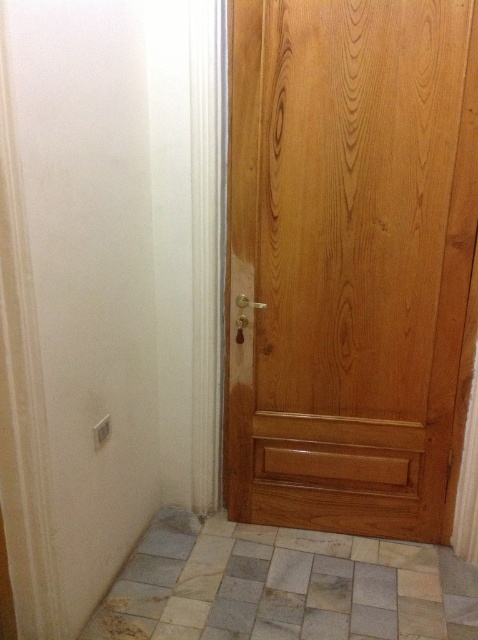
You are standing in the room and need to clean the wooden door at right and the natural stone tile at lower center. Which object requires a larger cleaning area?

The wooden door at right requires a larger cleaning area because it is larger in size than the natural stone tile at lower center.

You are a delivery person trying to move a 70 cm wide package through the doorway between the wooden door at right and the natural stone tile at lower center. Can you fit the package through the doorway?

The wooden door at right and natural stone tile at lower center are 66.99 centimeters apart, which is narrower than the 70 cm wide package. Therefore, the package cannot fit through the doorway.

You are standing in the room and want to determine which of the two points, point (368, 472) or point (390, 620), is closer to you. Based on the scene description, which point is nearer?

Point (368, 472) is further to the viewer than point (390, 620). Therefore, point (390, 620) is closer to you.